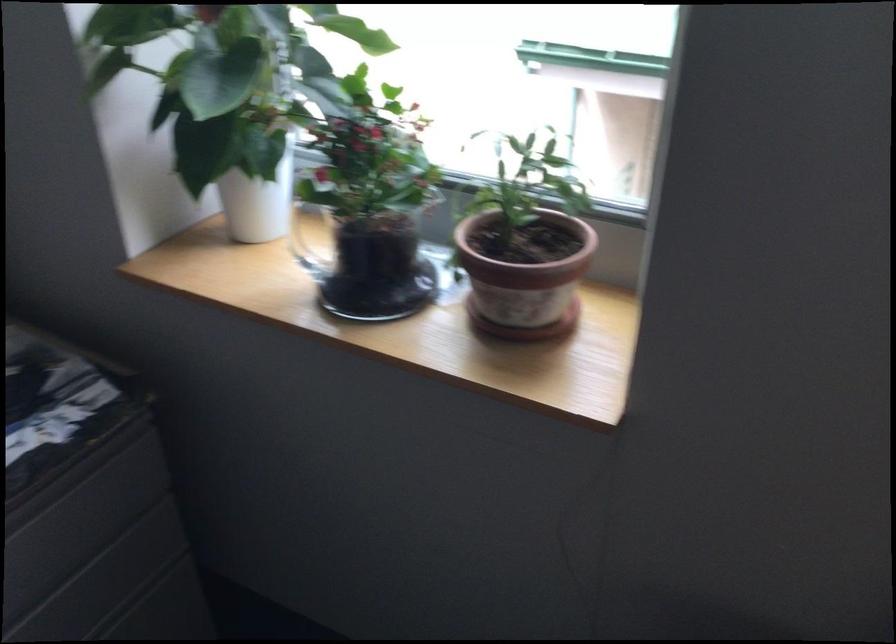
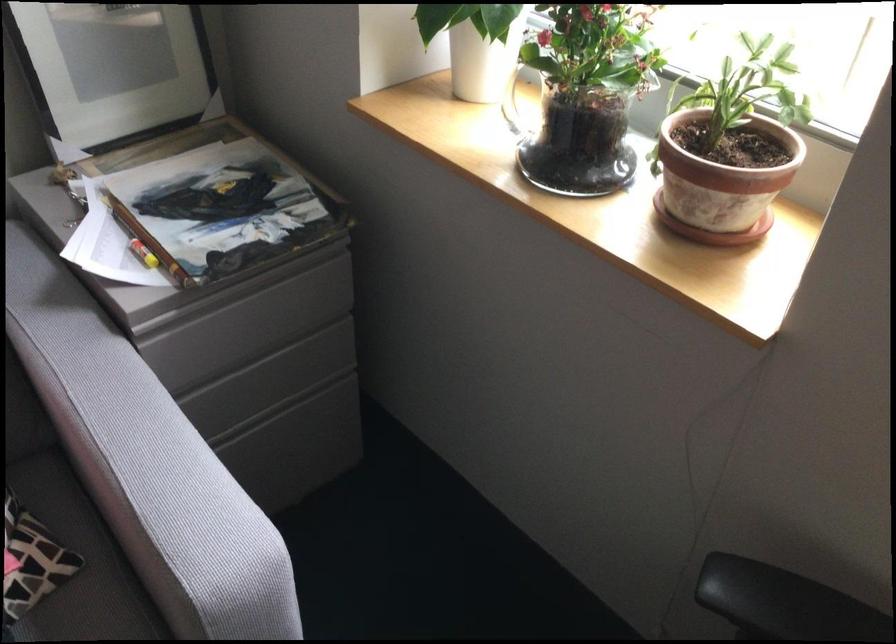
Find the pixel in the second image that matches point 236,191 in the first image.

(467, 44)